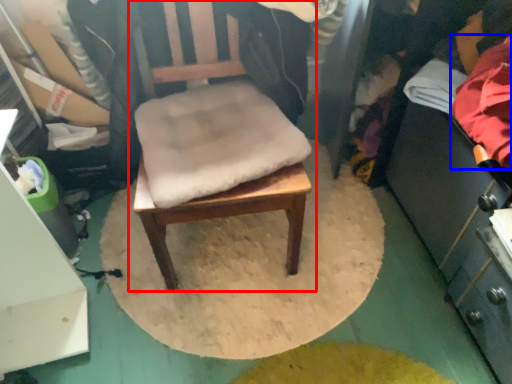
Question: Which point is further to the camera, chair (highlighted by a red box) or clothing (highlighted by a blue box)?

Choices:
 (A) chair
 (B) clothing

Answer: (B)